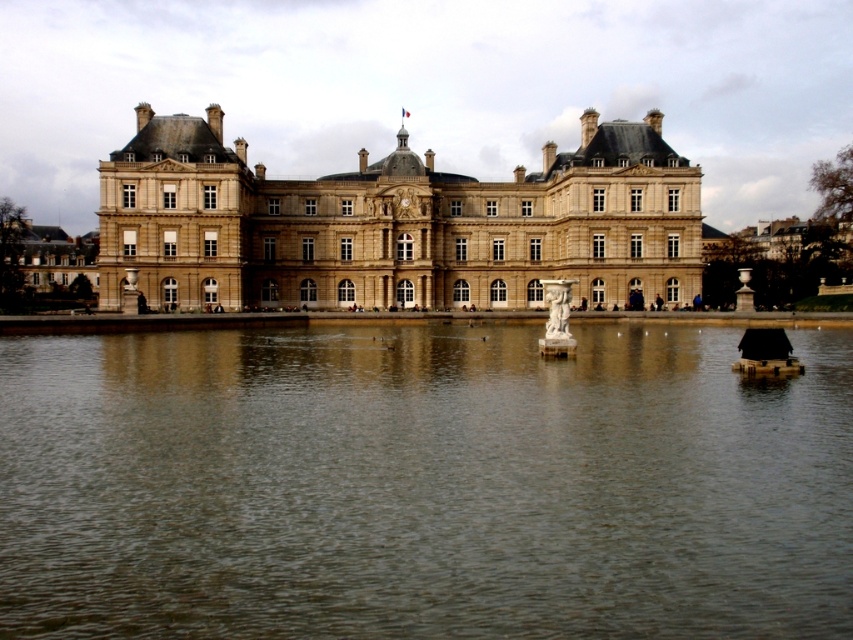
Can you confirm if brown reflective water at center is shorter than brown stone building at center?

Yes, brown reflective water at center is shorter than brown stone building at center.

Between point (44, 593) and point (689, 202), which one is positioned behind?

The point (689, 202) is more distant.

Identify the location of brown reflective water at center. The width and height of the screenshot is (853, 640). (422, 484).

Is brown stone building at center positioned before white marble statue at center?

No.

What are the coordinates of `brown stone building at center` in the screenshot? It's located at (396, 225).

Locate an element on the screen. brown stone building at center is located at coordinates (396, 225).

Who is more forward, (x=695, y=516) or (x=564, y=324)?

Point (x=695, y=516)

Image resolution: width=853 pixels, height=640 pixels. Find the location of `brown reflective water at center`. brown reflective water at center is located at coordinates (422, 484).